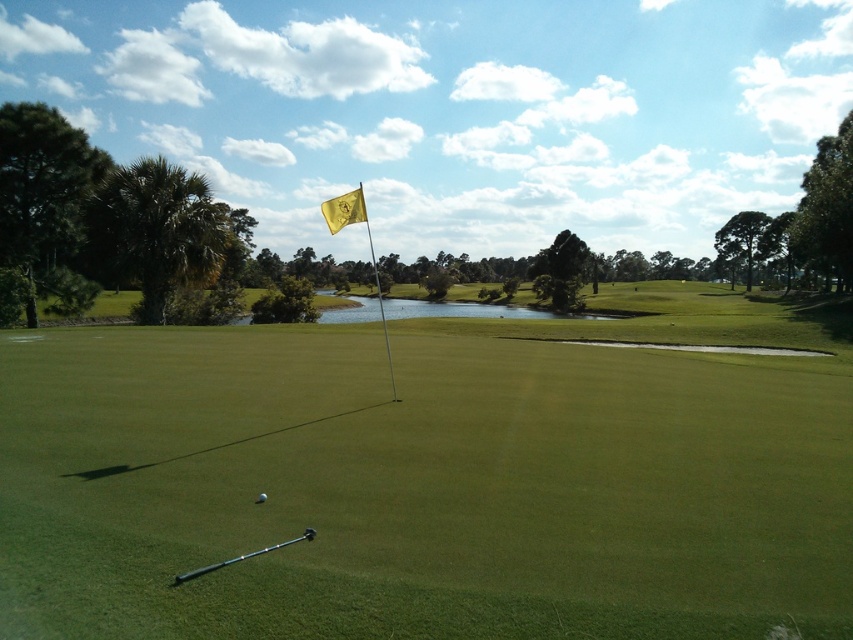
Can you confirm if green smooth grass at center is wider than black rubber golf club at lower center?

Yes.

Who is more distant from viewer, (169, 432) or (219, 563)?

Positioned behind is point (169, 432).

The height and width of the screenshot is (640, 853). What are the coordinates of `green smooth grass at center` in the screenshot? It's located at (430, 477).

Describe the element at coordinates (344, 209) in the screenshot. I see `gold fabric flag at center` at that location.

Which of these two, gold fabric flag at center or white matte golf ball at center, stands shorter?

With less height is white matte golf ball at center.

Which is in front, point (350, 220) or point (263, 500)?

Point (263, 500) is in front.

Locate an element on the screen. The image size is (853, 640). gold fabric flag at center is located at coordinates (344, 209).

Between black rubber golf club at lower center and white matte golf ball at center, which one appears on the right side from the viewer's perspective?

black rubber golf club at lower center is more to the right.

Based on the photo, is black rubber golf club at lower center positioned behind white matte golf ball at center?

That is False.

Describe the element at coordinates (242, 557) in the screenshot. I see `black rubber golf club at lower center` at that location.

Where is `black rubber golf club at lower center`? This screenshot has height=640, width=853. black rubber golf club at lower center is located at coordinates (242, 557).